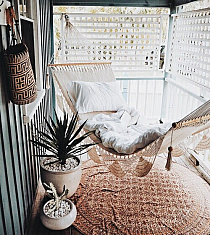
You are a GUI agent. You are given a task and a screenshot of the screen. Output one action in this format:
    pyautogui.click(x=<x>, y=<y>)
    Task: Click on the rug
    Image resolution: width=210 pixels, height=235 pixels.
    Given the screenshot: What is the action you would take?
    pyautogui.click(x=182, y=197)